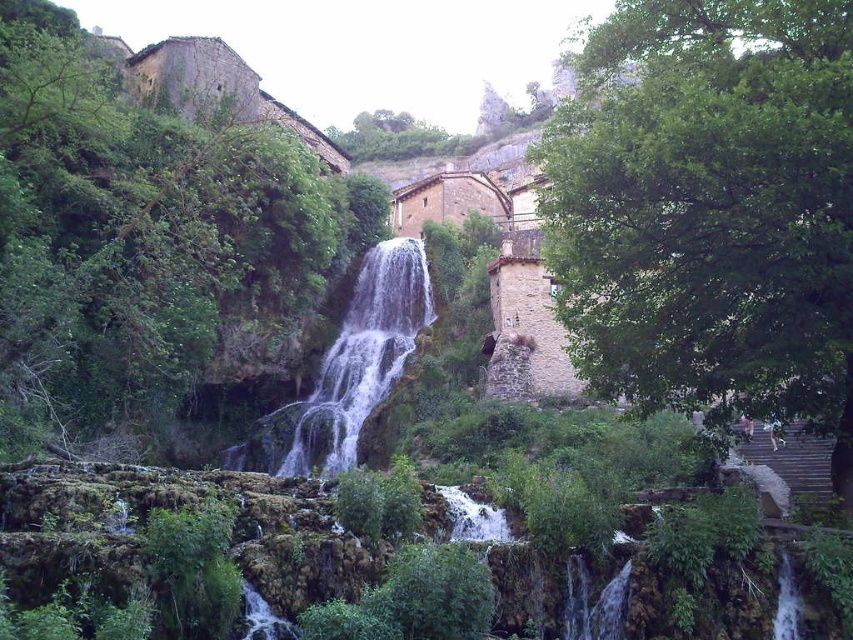
Question: Considering the relative positions of green leafy tree at center and white frothy water at center in the image provided, where is green leafy tree at center located with respect to white frothy water at center?

Choices:
 (A) below
 (B) above

Answer: (B)

Question: Which of these objects is positioned farthest from the white frothy water at center?

Choices:
 (A) green leafy tree at upper left
 (B) green leafy tree at upper center

Answer: (B)

Question: Does green leafy tree at center have a smaller size compared to white frothy water at center?

Choices:
 (A) yes
 (B) no

Answer: (B)

Question: Which object is farther from the camera taking this photo?

Choices:
 (A) green leafy tree at upper center
 (B) green leafy tree at center

Answer: (A)

Question: Can you confirm if green leafy tree at center is positioned to the right of white frothy water at center?

Choices:
 (A) no
 (B) yes

Answer: (B)

Question: Which is farther from the white frothy water at center?

Choices:
 (A) green leafy tree at upper left
 (B) green leafy tree at center

Answer: (B)